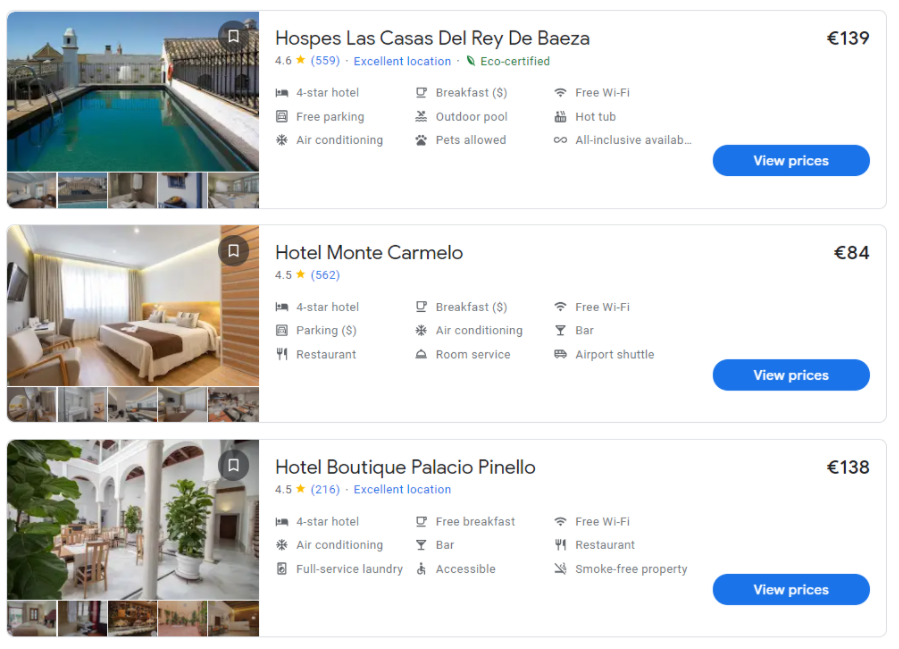
Identify the location of curtains. (100, 293).